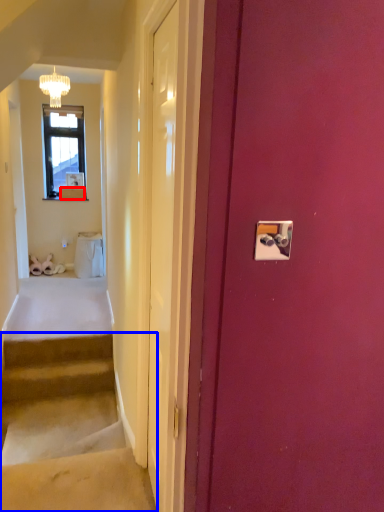
Question: Which object is closer to the camera taking this photo, box (highlighted by a red box) or stairs (highlighted by a blue box)?

Choices:
 (A) box
 (B) stairs

Answer: (B)